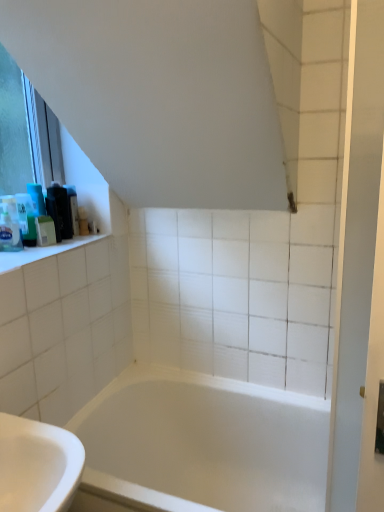
Question: Can you confirm if translucent plastic bottle at left, the third toiletry positioned from the front, is bigger than matte black soap dispenser at upper left, the 5th toiletry in the front-to-back sequence?

Choices:
 (A) no
 (B) yes

Answer: (B)

Question: From the image's perspective, is translucent plastic bottle at left, the third toiletry positioned from the front, under matte black soap dispenser at upper left, which appears as the first toiletry when viewed from the back?

Choices:
 (A) no
 (B) yes

Answer: (B)

Question: Does translucent plastic bottle at left, the third toiletry positioned from the front, have a lesser height compared to matte black soap dispenser at upper left, the 5th toiletry in the front-to-back sequence?

Choices:
 (A) yes
 (B) no

Answer: (B)

Question: From a real-world perspective, is translucent plastic bottle at left, marked as the third toiletry in a back-to-front arrangement, positioned over matte black soap dispenser at upper left, the 5th toiletry in the front-to-back sequence, based on gravity?

Choices:
 (A) no
 (B) yes

Answer: (B)

Question: Does translucent plastic bottle at left, the third toiletry positioned from the front, have a lesser width compared to matte black soap dispenser at upper left, the 5th toiletry in the front-to-back sequence?

Choices:
 (A) yes
 (B) no

Answer: (B)

Question: Considering the relative positions of translucent plastic bottle at left, marked as the third toiletry in a back-to-front arrangement, and matte black soap dispenser at upper left, the 5th toiletry in the front-to-back sequence, in the image provided, is translucent plastic bottle at left, marked as the third toiletry in a back-to-front arrangement, to the right of matte black soap dispenser at upper left, the 5th toiletry in the front-to-back sequence, from the viewer's perspective?

Choices:
 (A) yes
 (B) no

Answer: (B)

Question: Could black plastic container at upper left, the second toiletry in the back-to-front sequence, be considered to be inside green matte soap at left, the 2th toiletry when ordered from front to back?

Choices:
 (A) no
 (B) yes

Answer: (A)

Question: Is green matte soap at left, which is the 4th toiletry from back to front, placed right next to black plastic container at upper left, the second toiletry in the back-to-front sequence?

Choices:
 (A) no
 (B) yes

Answer: (B)

Question: From the image's perspective, is green matte soap at left, the 2th toiletry when ordered from front to back, located above black plastic container at upper left, the second toiletry in the back-to-front sequence?

Choices:
 (A) yes
 (B) no

Answer: (B)

Question: Is green matte soap at left, which is the 4th toiletry from back to front, at the left side of black plastic container at upper left, the second toiletry in the back-to-front sequence?

Choices:
 (A) yes
 (B) no

Answer: (A)

Question: Are green matte soap at left, the 2th toiletry when ordered from front to back, and black plastic container at upper left, the second toiletry in the back-to-front sequence, located far from each other?

Choices:
 (A) no
 (B) yes

Answer: (A)

Question: From a real-world perspective, is green matte soap at left, which is the 4th toiletry from back to front, on top of black plastic container at upper left, marked as the 4th toiletry in a front-to-back arrangement?

Choices:
 (A) no
 (B) yes

Answer: (A)

Question: Is white glossy screen door at right turned away from black plastic container at upper left, the second toiletry in the back-to-front sequence?

Choices:
 (A) yes
 (B) no

Answer: (B)